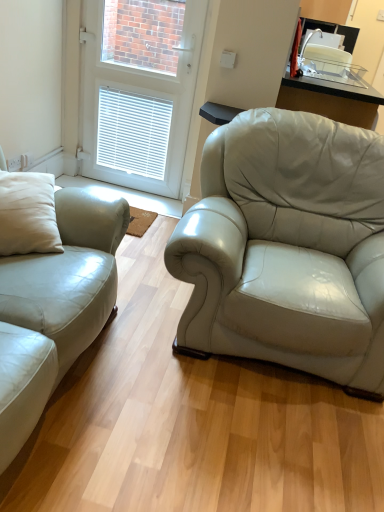
Identify the location of satin white leather couch at left. (55, 307).

What do you see at coordinates (55, 307) in the screenshot? I see `satin white leather couch at left` at bounding box center [55, 307].

The width and height of the screenshot is (384, 512). What do you see at coordinates (138, 90) in the screenshot?
I see `white glossy door at upper center` at bounding box center [138, 90].

Where is `white glossy door at upper center`? The height and width of the screenshot is (512, 384). white glossy door at upper center is located at coordinates (138, 90).

Find the location of a particular element. The image size is (384, 512). satin white leather couch at left is located at coordinates (55, 307).

Considering the positions of objects white glossy door at upper center and satin white leather couch at left in the image provided, who is more to the right, white glossy door at upper center or satin white leather couch at left?

white glossy door at upper center.

Which object is more forward, white glossy door at upper center or satin white leather couch at left?

satin white leather couch at left is more forward.

Considering the positions of point (152, 71) and point (6, 331), is point (152, 71) closer or farther from the camera than point (6, 331)?

Clearly, point (152, 71) is more distant from the camera than point (6, 331).

From the image's perspective, is white glossy door at upper center located above or below satin white leather couch at left?

Clearly, from the image's perspective, white glossy door at upper center is above satin white leather couch at left.

From a real-world perspective, between white glossy door at upper center and satin white leather couch at left, who is vertically lower?

satin white leather couch at left, from a real-world perspective.

Which of these two, white glossy door at upper center or satin white leather couch at left, is thinner?

white glossy door at upper center is thinner.

Which of these two, white glossy door at upper center or satin white leather couch at left, stands taller?

Standing taller between the two is white glossy door at upper center.

Based on their sizes in the image, would you say white glossy door at upper center is bigger or smaller than satin white leather couch at left?

In the image, white glossy door at upper center appears to be smaller than satin white leather couch at left.

Is satin white leather couch at left located within white glossy door at upper center?

No, white glossy door at upper center does not contain satin white leather couch at left.

Is there a large distance between white glossy door at upper center and satin white leather couch at left?

Absolutely, white glossy door at upper center is distant from satin white leather couch at left.

Could you tell me if white glossy door at upper center is facing satin white leather couch at left?

Yes, white glossy door at upper center is aimed at satin white leather couch at left.

I want to click on studio couch that appears in front of the white glossy door at upper center, so click(55, 307).

Is satin white leather couch at left to the left or to the right of white glossy door at upper center in the image?

In the image, satin white leather couch at left appears on the left side of white glossy door at upper center.

Is the depth of satin white leather couch at left greater than that of white glossy door at upper center?

No, the depth of satin white leather couch at left is less than that of white glossy door at upper center.

Is point (54, 366) closer or farther from the camera than point (86, 12)?

Point (54, 366) is positioned closer to the camera compared to point (86, 12).

From the image's perspective, is satin white leather couch at left above or below white glossy door at upper center?

satin white leather couch at left is situated lower than white glossy door at upper center in the image.

From a real-world perspective, does satin white leather couch at left stand above white glossy door at upper center?

No.

Does satin white leather couch at left have a greater width compared to white glossy door at upper center?

Yes.

Which of these two, satin white leather couch at left or white glossy door at upper center, stands shorter?

satin white leather couch at left.

Considering the sizes of satin white leather couch at left and white glossy door at upper center in the image, is satin white leather couch at left bigger or smaller than white glossy door at upper center?

In the image, satin white leather couch at left appears to be larger than white glossy door at upper center.

Is satin white leather couch at left located outside white glossy door at upper center?

Yes, satin white leather couch at left is located beyond the bounds of white glossy door at upper center.

Is satin white leather couch at left positioned far away from white glossy door at upper center?

Yes, satin white leather couch at left and white glossy door at upper center are located far from each other.

Is satin white leather couch at left looking in the opposite direction of white glossy door at upper center?

No.

How distant is satin white leather couch at left from white glossy door at upper center?

They are 5.31 feet apart.

This screenshot has height=512, width=384. In the image, there is a white glossy door at upper center. What are the coordinates of `studio couch below it (from a real-world perspective)` in the screenshot? It's located at (55, 307).

Image resolution: width=384 pixels, height=512 pixels. What are the coordinates of `studio couch below the white glossy door at upper center (from the image's perspective)` in the screenshot? It's located at (55, 307).

Locate an element on the screen. studio couch in front of the white glossy door at upper center is located at coordinates (55, 307).